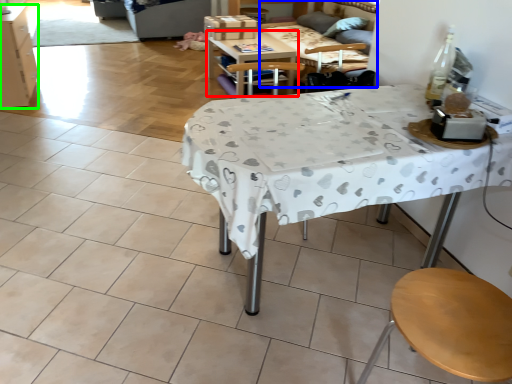
Question: Which object is the farthest from table (highlighted by a red box)? Choose among these: couch (highlighted by a blue box) or cabinetry (highlighted by a green box).

Choices:
 (A) couch
 (B) cabinetry

Answer: (B)